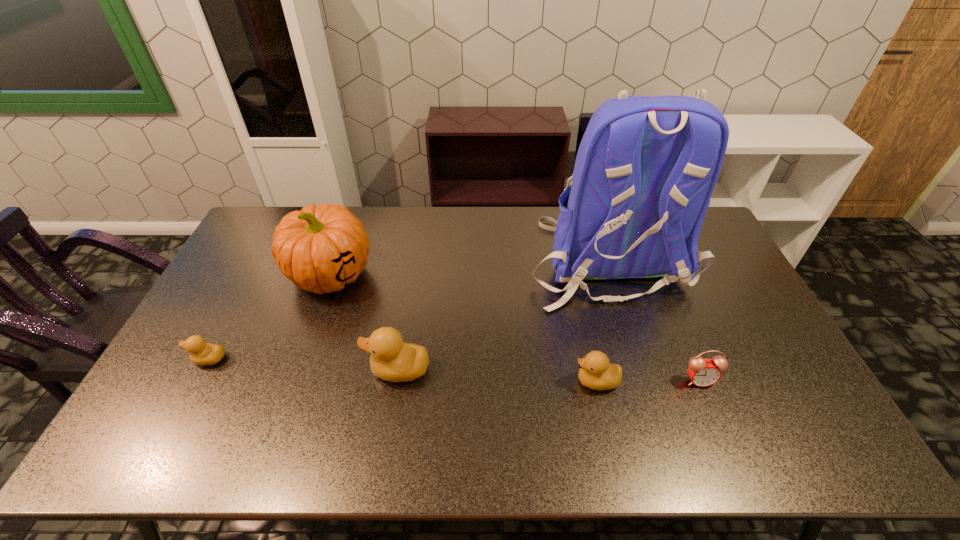
Where is `vacant space located on the face of the fourth shortest object`? The image size is (960, 540). vacant space located on the face of the fourth shortest object is located at coordinates point(278,370).

The width and height of the screenshot is (960, 540). I want to click on vacant space located on the face of the fourth shortest object, so click(x=348, y=370).

At what (x,y) coordinates should I click in order to perform the action: click on vacant region located 0.120m on the face of the fourth shortest object. Please return your answer as a coordinate pair (x, y). Image resolution: width=960 pixels, height=540 pixels. Looking at the image, I should click on (323, 370).

Where is `vacant space located 0.330m on the face of the second shortest duckling`? Image resolution: width=960 pixels, height=540 pixels. vacant space located 0.330m on the face of the second shortest duckling is located at coordinates (449, 381).

This screenshot has width=960, height=540. I want to click on vacant space positioned 0.350m on the face of the second shortest duckling, so click(442, 381).

Locate an element on the screen. The width and height of the screenshot is (960, 540). vacant region located on the face of the second shortest duckling is located at coordinates (479, 381).

Where is `blank space located on the back of the backpack`? blank space located on the back of the backpack is located at coordinates (652, 398).

Where is `vacant point located 0.360m on the surface of the pumpkin`? The width and height of the screenshot is (960, 540). vacant point located 0.360m on the surface of the pumpkin is located at coordinates (281, 414).

Where is `backpack present at the far edge`? The height and width of the screenshot is (540, 960). backpack present at the far edge is located at coordinates (646, 167).

At what (x,y) coordinates should I click in order to perform the action: click on pumpkin that is positioned at the far edge. Please return your answer as a coordinate pair (x, y). The image size is (960, 540). Looking at the image, I should click on (320, 249).